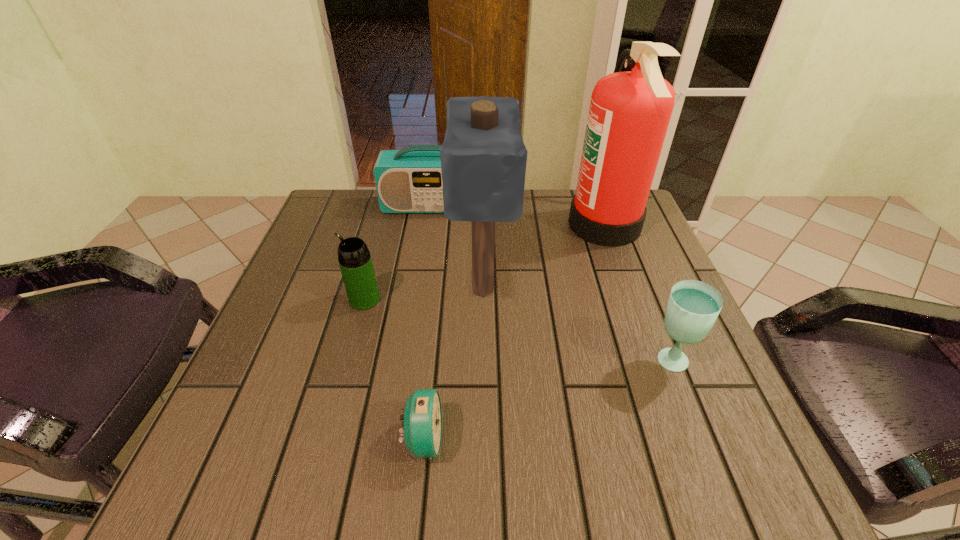
What are the coordinates of `vacant region located on the front of the mallet` in the screenshot? It's located at (484, 481).

Locate an element on the screen. This screenshot has height=540, width=960. free space located on the front panel of the radio receiver is located at coordinates (425, 245).

This screenshot has height=540, width=960. Identify the location of vacant space located 0.160m from the spout of the thermos bottle. (275, 300).

Image resolution: width=960 pixels, height=540 pixels. I want to click on vacant space located from the spout of the thermos bottle, so click(x=275, y=300).

The image size is (960, 540). In order to click on vacant space located on the left of the fifth farthest object in this screenshot , I will do `click(594, 361)`.

Locate an element on the screen. vacant space located 0.070m on the front-facing side of the nearest object is located at coordinates [486, 440].

Where is `fire extinguisher that is at the far edge`? fire extinguisher that is at the far edge is located at coordinates (629, 113).

In order to click on radio receiver located in the far edge section of the desktop in this screenshot , I will do `click(409, 180)`.

I want to click on object located at the near edge, so click(x=422, y=433).

Image resolution: width=960 pixels, height=540 pixels. Find the location of `object positioned at the left edge`. object positioned at the left edge is located at coordinates (354, 258).